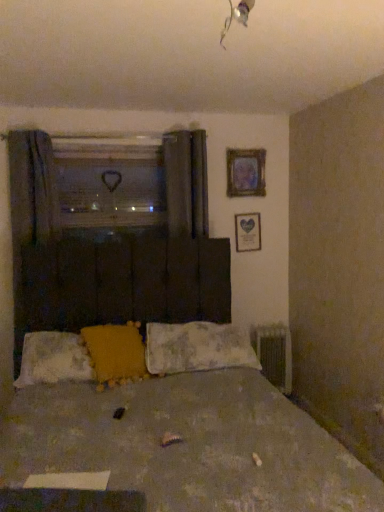
Question: In the image, is clear plastic heart at upper center positioned in front of or behind dark gray fabric curtain at left?

Choices:
 (A) front
 (B) behind

Answer: (B)

Question: Which is correct: clear plastic heart at upper center is inside dark gray fabric curtain at left, or outside of it?

Choices:
 (A) inside
 (B) outside

Answer: (B)

Question: Estimate the real-world distances between objects in this image. Which object is closer to the dark gray fabric curtain at left?

Choices:
 (A) fluffy white pillow at lower left, the 1th pillow in the left-to-right sequence
 (B) fluffy fabric pillow at center, which is the 3th pillow from left to right
 (C) clear plastic heart at upper center
 (D) matte glass picture frame at upper right, acting as the first picture frame starting from the top
 (E) yellow fabric pillow at center, the 2th pillow viewed from the left

Answer: (C)

Question: Which object is the farthest from the fluffy white pillow at lower left, the 1th pillow in the left-to-right sequence?

Choices:
 (A) yellow fabric pillow at center, the 2th pillow viewed from the left
 (B) fluffy fabric pillow at center, arranged as the 1th pillow when viewed from the right
 (C) wooden heart-shaped frame at upper right, the second picture frame from the top
 (D) worn fabric bed at center
 (E) clear plastic heart at upper center

Answer: (C)